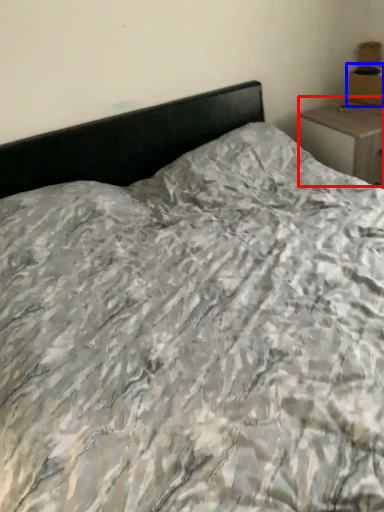
Question: Among these objects, which one is nearest to the camera, nightstand (highlighted by a red box) or cardboard box (highlighted by a blue box)?

Choices:
 (A) nightstand
 (B) cardboard box

Answer: (A)